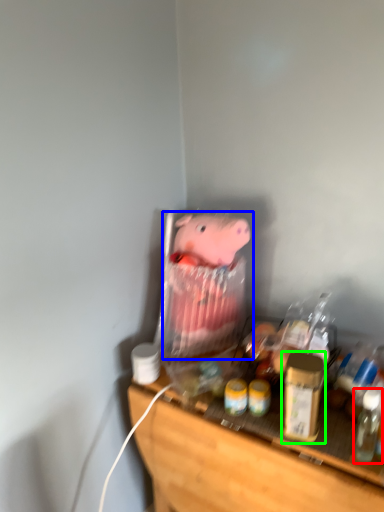
Question: Which object is positioned farthest from bottle (highlighted by a red box)? Select from toy (highlighted by a blue box) and beverage (highlighted by a green box).

Choices:
 (A) toy
 (B) beverage

Answer: (A)